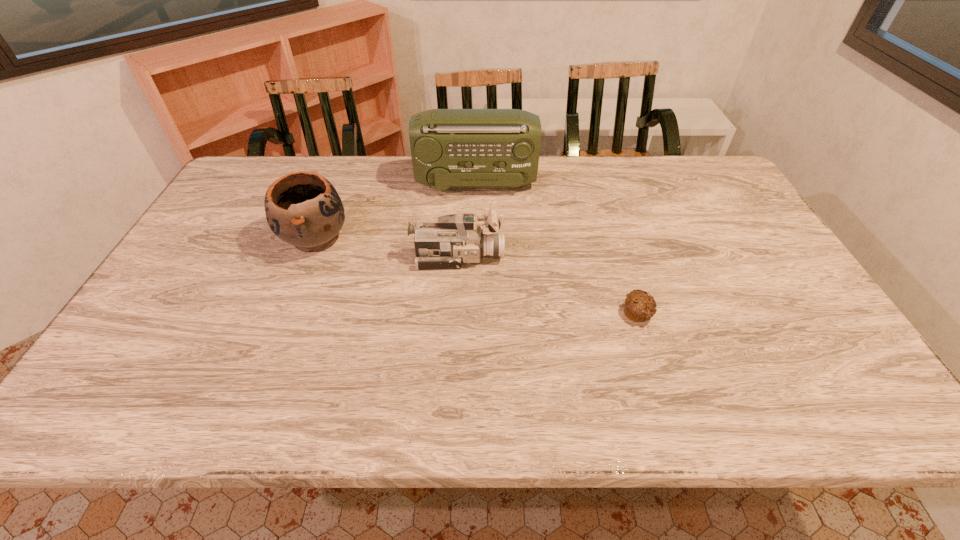
Identify the location of object present at the far edge. This screenshot has height=540, width=960. (450, 148).

You are a GUI agent. You are given a task and a screenshot of the screen. Output one action in this format:
    pyautogui.click(x=<x>, y=<y>)
    Task: Click on the blank space at the far edge of the desktop
    Image resolution: width=960 pixels, height=540 pixels.
    Given the screenshot: What is the action you would take?
    pyautogui.click(x=361, y=188)

I want to click on vacant position at the near edge of the desktop, so click(310, 408).

This screenshot has width=960, height=540. I want to click on vacant area at the left edge, so click(149, 357).

Where is `vacant space at the right edge of the desktop`? vacant space at the right edge of the desktop is located at coordinates (806, 309).

You are a GUI agent. You are given a task and a screenshot of the screen. Output one action in this format:
    pyautogui.click(x=<x>, y=<y>)
    Task: Click on the vacant space at the far left corner of the desktop
    The height and width of the screenshot is (540, 960).
    Given the screenshot: What is the action you would take?
    pyautogui.click(x=238, y=183)

This screenshot has height=540, width=960. Identify the location of vacant space at the far right corner of the desktop. coord(685,178).

The width and height of the screenshot is (960, 540). What are the coordinates of `free area in between the muffin and the camcorder` in the screenshot? It's located at (548, 285).

Locate an element on the screen. free space between the nearest object and the leftmost object is located at coordinates (476, 276).

Identify the location of free space between the camcorder and the muffin. The height and width of the screenshot is (540, 960). (548, 285).